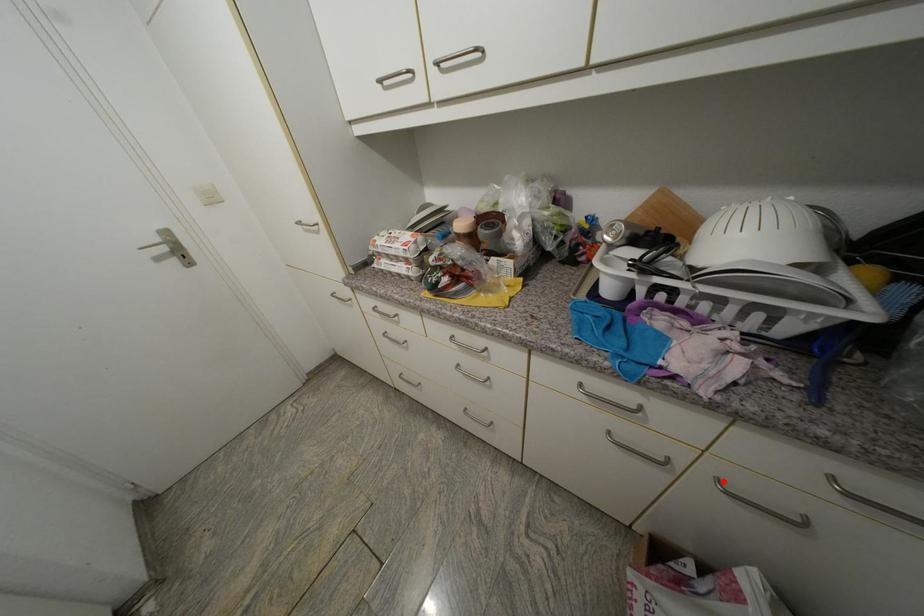
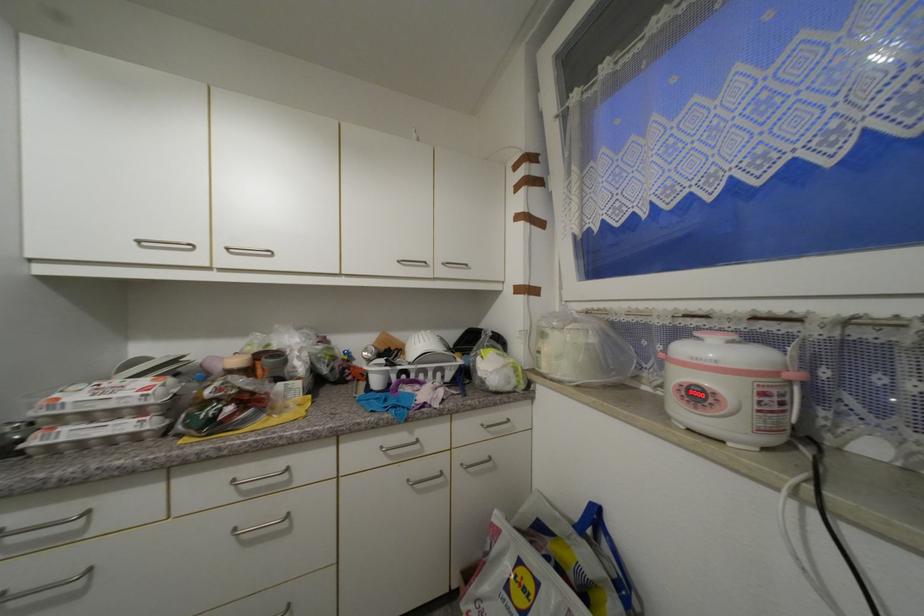
Question: I am providing you with two images of the same scene from different viewpoints. A red point is shown in image1. For the corresponding object point in image2, is it positioned nearer or farther from the camera?

Choices:
 (A) Nearer
 (B) Farther

Answer: (B)